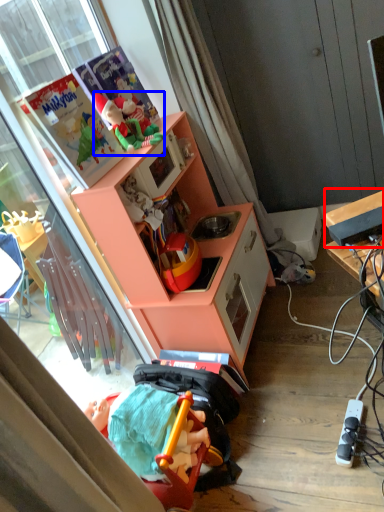
Question: Which object appears farthest to the camera in this image, appliance (highlighted by a red box) or toy (highlighted by a blue box)?

Choices:
 (A) appliance
 (B) toy

Answer: (B)